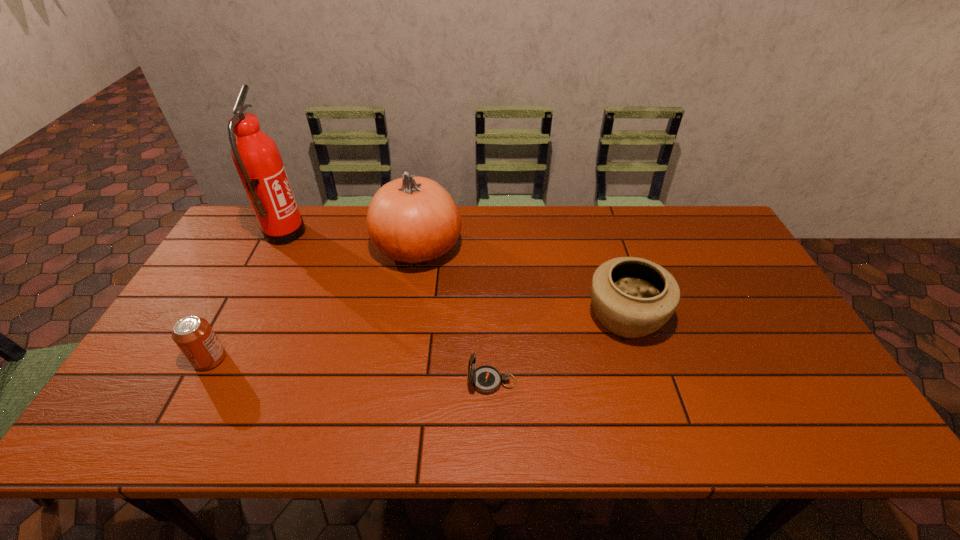
Where is `vacant space at the far edge`? vacant space at the far edge is located at coordinates (468, 246).

Where is `vacant space at the near edge of the desktop`? The width and height of the screenshot is (960, 540). vacant space at the near edge of the desktop is located at coordinates (485, 411).

Where is `vacant space at the right edge of the desktop`? The width and height of the screenshot is (960, 540). vacant space at the right edge of the desktop is located at coordinates (765, 304).

Where is `vacant point located between the can and the third shortest object`? vacant point located between the can and the third shortest object is located at coordinates tap(418, 338).

I want to click on free space between the fire extinguisher and the fourth shortest object, so click(x=351, y=241).

Identify the location of free space between the fire extinguisher and the can. coord(247,296).

At what (x,y) coordinates should I click in order to perform the action: click on free space that is in between the fire extinguisher and the rightmost object. Please return your answer as a coordinate pair (x, y). Image resolution: width=960 pixels, height=540 pixels. Looking at the image, I should click on (454, 275).

Locate an element on the screen. This screenshot has height=540, width=960. vacant point located between the fire extinguisher and the second tallest object is located at coordinates (351, 241).

This screenshot has width=960, height=540. What are the coordinates of `vacant area that lies between the second object from right to left and the pumpkin` in the screenshot? It's located at (455, 315).

Locate an element on the screen. Image resolution: width=960 pixels, height=540 pixels. free space between the second tallest object and the fire extinguisher is located at coordinates (351, 241).